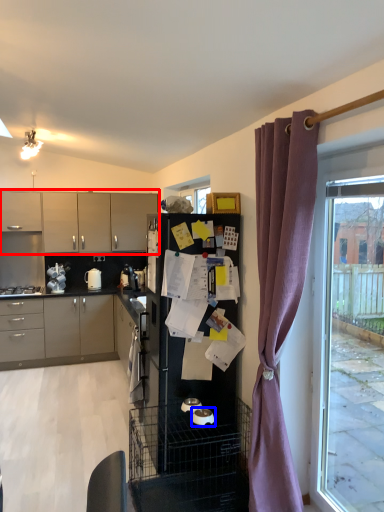
Question: Among these objects, which one is nearest to the camera, cabinetry (highlighted by a red box) or appliance (highlighted by a blue box)?

Choices:
 (A) cabinetry
 (B) appliance

Answer: (B)